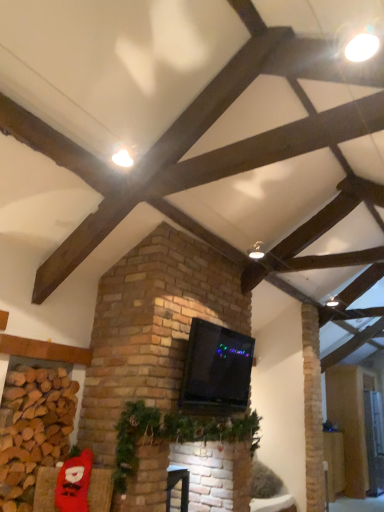
What do you see at coordinates (33, 429) in the screenshot?
I see `brown brick at lower left` at bounding box center [33, 429].

Where is `black glossy tv at center`? The image size is (384, 512). black glossy tv at center is located at coordinates (216, 370).

Identify the location of wooden floorboard at lower right. This screenshot has width=384, height=512. (334, 462).

Who is shorter, wooden floorboard at lower right or red plush santa at lower left?

With less height is red plush santa at lower left.

How different are the orientations of wooden floorboard at lower right and red plush santa at lower left in degrees?

They differ by 46.6 degrees in their facing directions.

From a real-world perspective, which object stands above the other?

red plush santa at lower left.

Based on their sizes in the image, would you say wooden floorboard at lower right is bigger or smaller than red plush santa at lower left?

Considering their sizes, wooden floorboard at lower right takes up more space than red plush santa at lower left.

Considering the positions of objects black glossy tv at center and brown brick at lower left in the image provided, who is more to the right, black glossy tv at center or brown brick at lower left?

From the viewer's perspective, black glossy tv at center appears more on the right side.

From the image's perspective, is black glossy tv at center located above brown brick at lower left?

Yes, from the image's perspective, black glossy tv at center is on top of brown brick at lower left.

Who is more distant, black glossy tv at center or brown brick at lower left?

black glossy tv at center is behind.

Is black glossy tv at center beside brown brick at lower left?

black glossy tv at center and brown brick at lower left are not in contact.

Is red plush santa at lower left oriented towards brown brick at lower left?

No, red plush santa at lower left is not turned towards brown brick at lower left.

Considering the positions of objects red plush santa at lower left and brown brick at lower left in the image provided, who is behind, red plush santa at lower left or brown brick at lower left?

red plush santa at lower left is behind.

Which point is more distant from viewer, (68, 490) or (13, 372)?

Positioned behind is point (13, 372).

Is red plush santa at lower left taller than brown brick at lower left?

Incorrect, the height of red plush santa at lower left is not larger of that of brown brick at lower left.

What's the angular difference between green garland at center and red plush santa at lower left's facing directions?

The angle between the facing direction of green garland at center and the facing direction of red plush santa at lower left is 46.1 degrees.

Could red plush santa at lower left be considered to be inside green garland at center?

That's incorrect, red plush santa at lower left is not inside green garland at center.

Does green garland at center appear on the left side of red plush santa at lower left?

In fact, green garland at center is to the right of red plush santa at lower left.

How many degrees apart are the facing directions of green garland at center and black glossy tv at center?

0.00153 degrees.

Between green garland at center and black glossy tv at center, which one has less height?

green garland at center is shorter.

From the image's perspective, which is below, green garland at center or black glossy tv at center?

green garland at center appears lower in the image.

From the picture: Does green garland at center turn towards black glossy tv at center?

No, green garland at center does not turn towards black glossy tv at center.

Who is shorter, red plush santa at lower left or black glossy tv at center?

red plush santa at lower left is shorter.

From a real-world perspective, is red plush santa at lower left above or below black glossy tv at center?

From a real-world perspective, red plush santa at lower left is physically below black glossy tv at center.

You are a GUI agent. You are given a task and a screenshot of the screen. Output one action in this format:
    pyautogui.click(x=<x>, y=<y>)
    Task: Click on the wide above the red plush santa at lower left (from the image's perspective)
    
    Given the screenshot: What is the action you would take?
    pyautogui.click(x=216, y=370)

Which object is further away from the camera, green garland at center or brown brick at lower left?

green garland at center.

I want to click on brickwork in front of the green garland at center, so tap(33, 429).

Is green garland at center not within brown brick at lower left?

Yes, green garland at center is not within brown brick at lower left.

Which of these two, green garland at center or brown brick at lower left, is smaller?

brown brick at lower left.

The image size is (384, 512). I want to click on furniture below the red plush santa at lower left (from a real-world perspective), so click(x=334, y=462).

Where is `brickwork that appears on the left of black glossy tv at center`? This screenshot has height=512, width=384. brickwork that appears on the left of black glossy tv at center is located at coordinates (33, 429).

Looking at the image, which one is located closer to brown brick at lower left, green garland at center or matte white ceiling light at upper center?

Based on the image, green garland at center appears to be nearer to brown brick at lower left.

When comparing their distances from matte white ceiling light at upper center, does red plush santa at lower left or brown brick at lower left seem further?

Among the two, red plush santa at lower left is located further to matte white ceiling light at upper center.

Based on their spatial positions, is black glossy tv at center or wooden floorboard at lower right closer to brown brick at lower left?

Based on the image, black glossy tv at center appears to be nearer to brown brick at lower left.

Considering their positions, is black glossy tv at center positioned closer to wooden floorboard at lower right than green garland at center?

green garland at center lies closer to wooden floorboard at lower right than the other object.

Estimate the real-world distances between objects in this image. Which object is closer to brown brick at lower left, wooden floorboard at lower right or matte white ceiling light at upper center?

matte white ceiling light at upper center is positioned closer to the anchor brown brick at lower left.

Which object lies nearer to the anchor point green garland at center, brown brick at lower left or red plush santa at lower left?

Based on the image, red plush santa at lower left appears to be nearer to green garland at center.

Based on their spatial positions, is matte white ceiling light at upper center or green garland at center closer to brown brick at lower left?

Based on the image, green garland at center appears to be nearer to brown brick at lower left.

Based on their spatial positions, is matte white ceiling light at upper center or green garland at center further from wooden floorboard at lower right?

matte white ceiling light at upper center is positioned further to the anchor wooden floorboard at lower right.

Identify the location of wide located between brown brick at lower left and matte white ceiling light at upper center in the left-right direction. (216, 370).

Find the location of a particular element. Image resolution: width=384 pixels, height=512 pixels. christmas decoration between brown brick at lower left and black glossy tv at center is located at coordinates (173, 434).

Identify the location of wide between matte white ceiling light at upper center and red plush santa at lower left in the vertical direction. (216, 370).

Locate an element on the screen. This screenshot has width=384, height=512. santa claus between matte white ceiling light at upper center and green garland at center in the vertical direction is located at coordinates (74, 483).